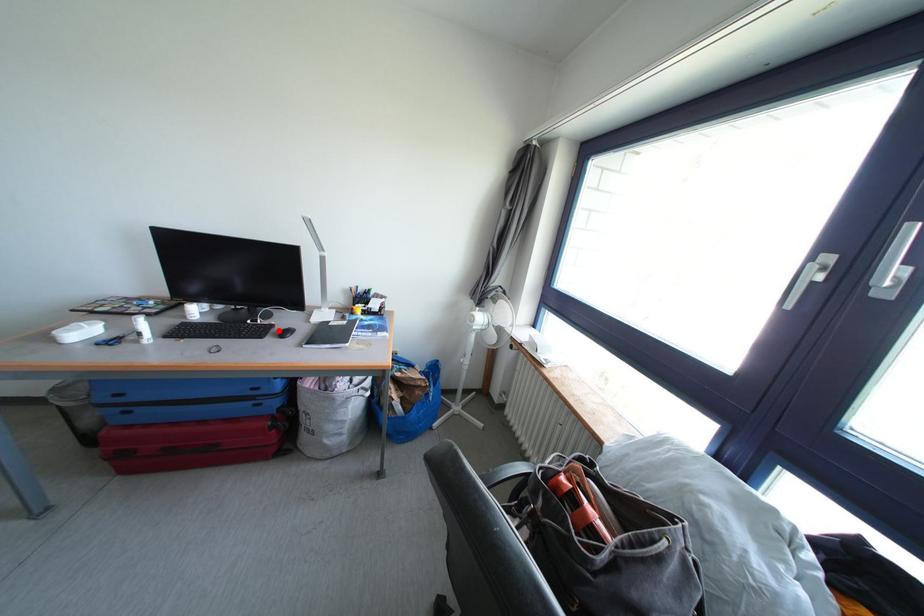
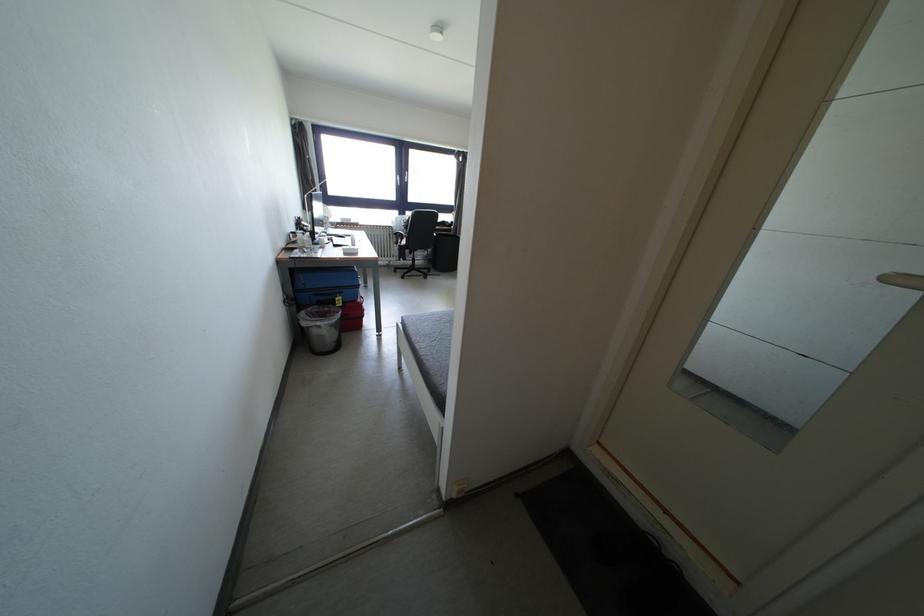
Question: I am providing you with two images of the same scene from different viewpoints. A red point is marked on the first image. Is the red point's position out of view in image 2?

Choices:
 (A) Yes
 (B) No

Answer: (A)